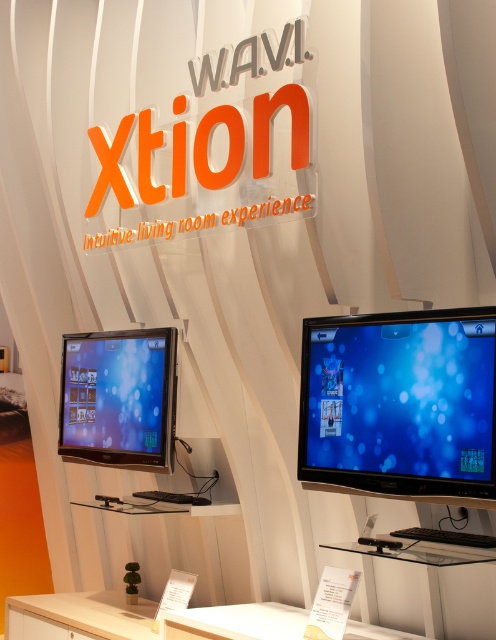
You are setting up a tech display for a product launch. You have two monitors to place on a glass shelf. The glossy black monitor at center and the satin black monitor at lower left. According to the scene, which monitor should be placed to the right side?

The glossy black monitor at center should be placed to the right of the satin black monitor at lower left as per the scene description.

Based on the photo, what are the coordinates of the glossy black monitor at center?

A: The glossy black monitor at center is located at coordinates point (399,403).

You are standing in front of the promotional display for W.A.V.I. Xtion. There is a glossy black monitor at center located at point (399, 403). If you want to touch the monitor, which direction should you move relative to your current position?

The glossy black monitor at center is located at point (399, 403), so you should move towards that coordinate to touch it.